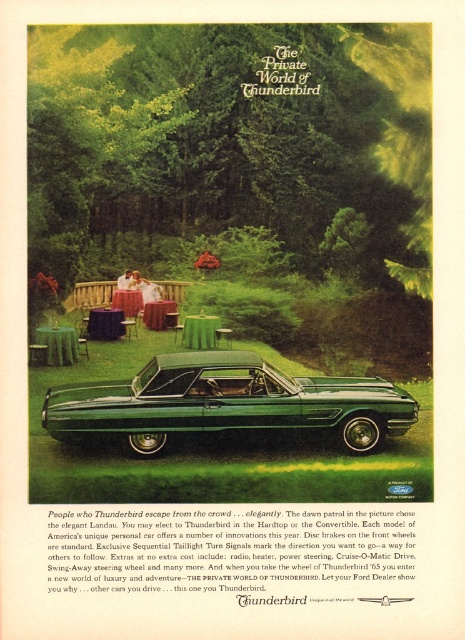
You are a photographer setting up a shoot for the Ford Thunderbird ad. You need to position a tripod between the green metallic car at lower center and the green fabric picnic table at lower left. Since the car is taller, will the tripod be more likely to block the view of the car or the picnic table?

The green metallic car at lower center is taller than the green fabric picnic table at lower left. Therefore, placing the tripod between them would more likely block the view of the picnic table since it is shorter and closer to the ground.

You are a photographer planning to take a photo of the green metallic car at lower center and the green fabric picnic table at lower left. Since both are green, how can you distinguish them in the photo?

The green metallic car at lower center is in front of the green fabric picnic table at lower left, so the car will appear closer and more prominent in the photo, making them distinguishable.

You are planning to take a photo of the green metallic car at lower center and the green fabric picnic table at lower left. To ensure both are visible in the frame, which object should you position closer to the camera?

The green metallic car at lower center is positioned on the right side of the green fabric picnic table at lower left. Therefore, you should position the green fabric picnic table at lower left closer to the camera to ensure both are visible in the frame.